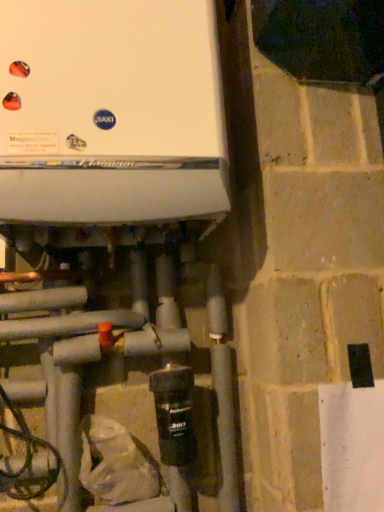
What do you see at coordinates (112, 252) in the screenshot?
I see `white matte boiler at upper center` at bounding box center [112, 252].

Where is `white matte boiler at upper center`? The image size is (384, 512). white matte boiler at upper center is located at coordinates (112, 252).

Locate an element on the screen. Image resolution: width=384 pixels, height=512 pixels. white matte boiler at upper center is located at coordinates (112, 252).